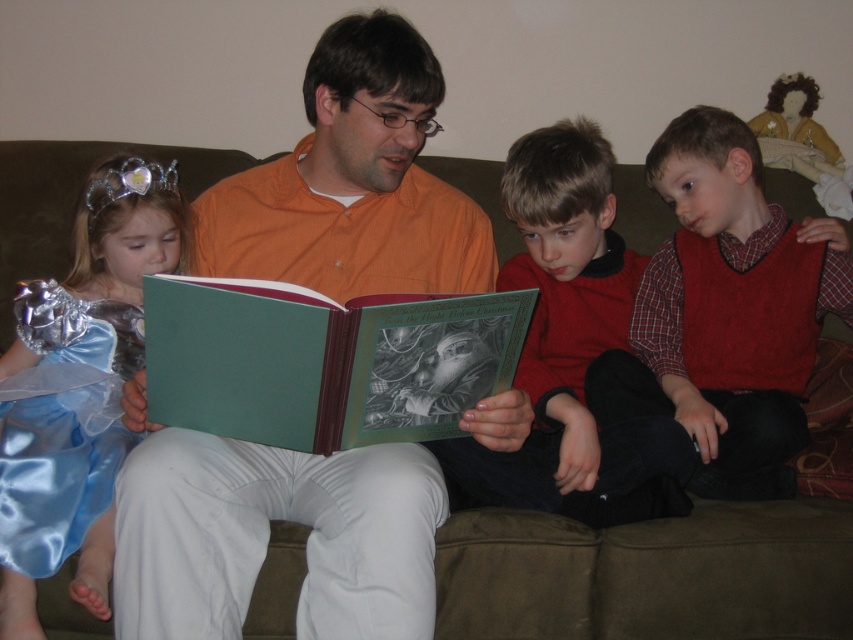
Is red flannel shirt at right shorter than green matte book at center?

In fact, red flannel shirt at right may be taller than green matte book at center.

Between point (645, 388) and point (189, 378), which one is positioned behind?

The point (645, 388) is behind.

Find the location of a particular element. Image resolution: width=853 pixels, height=640 pixels. red flannel shirt at right is located at coordinates (724, 312).

Between orange shirt at center and satin blue dress at left, which one has less height?

Standing shorter between the two is satin blue dress at left.

Does point (368, 257) come closer to viewer compared to point (113, 461)?

That is False.

Image resolution: width=853 pixels, height=640 pixels. I want to click on orange shirt at center, so click(x=268, y=536).

Is orange shirt at center wider than matte green book at center?

Yes, orange shirt at center is wider than matte green book at center.

Is point (279, 182) closer to camera compared to point (656, 456)?

No, it is behind (656, 456).

At what (x,y) coordinates should I click in order to perform the action: click on orange shirt at center. Please return your answer as a coordinate pair (x, y). Image resolution: width=853 pixels, height=640 pixels. Looking at the image, I should click on (268, 536).

You are a GUI agent. You are given a task and a screenshot of the screen. Output one action in this format:
    pyautogui.click(x=<x>, y=<y>)
    Task: Click on the orange shirt at center
    This screenshot has width=853, height=640.
    Given the screenshot: What is the action you would take?
    pyautogui.click(x=268, y=536)